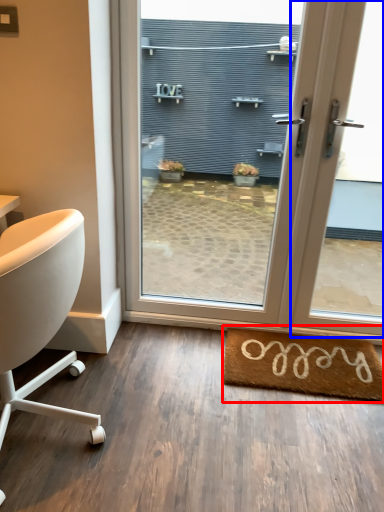
Question: Which point is further to the camera, mat (highlighted by a red box) or window (highlighted by a blue box)?

Choices:
 (A) mat
 (B) window

Answer: (A)